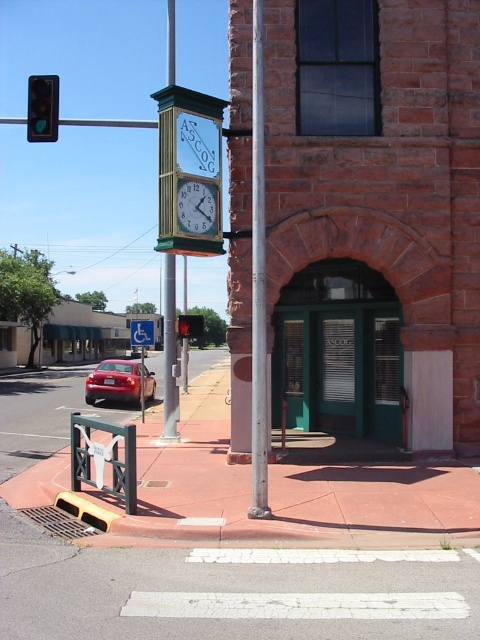
Question: Does blue plastic handicap sign at center have a greater width compared to metallic blue sign at upper center?

Choices:
 (A) yes
 (B) no

Answer: (B)

Question: Does shiny red sedan at lower left have a greater width compared to blue plastic handicap sign at center?

Choices:
 (A) no
 (B) yes

Answer: (B)

Question: Among these points, which one is nearest to the camera?

Choices:
 (A) (45, 140)
 (B) (192, 337)

Answer: (A)

Question: Which point is closer to the camera?

Choices:
 (A) shiny red sedan at lower left
 (B) blue plastic handicap sign at center

Answer: (B)

Question: Among these objects, which one is farthest from the camera?

Choices:
 (A) metallic blue sign at upper center
 (B) green glass traffic light at left
 (C) shiny red sedan at lower left
 (D) smooth silver pole at center

Answer: (C)

Question: Is green wooden clock at center bigger than metallic blue sign at upper center?

Choices:
 (A) yes
 (B) no

Answer: (B)